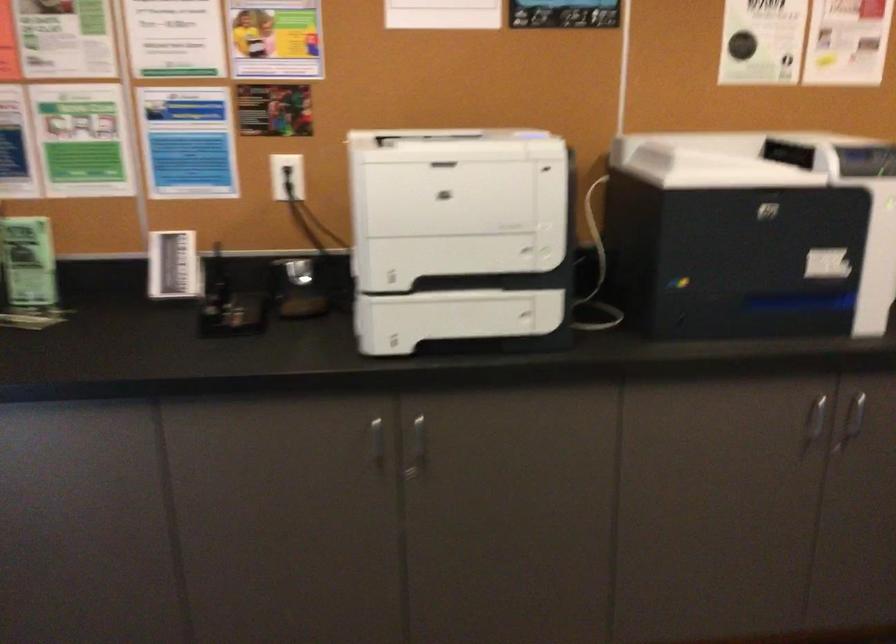
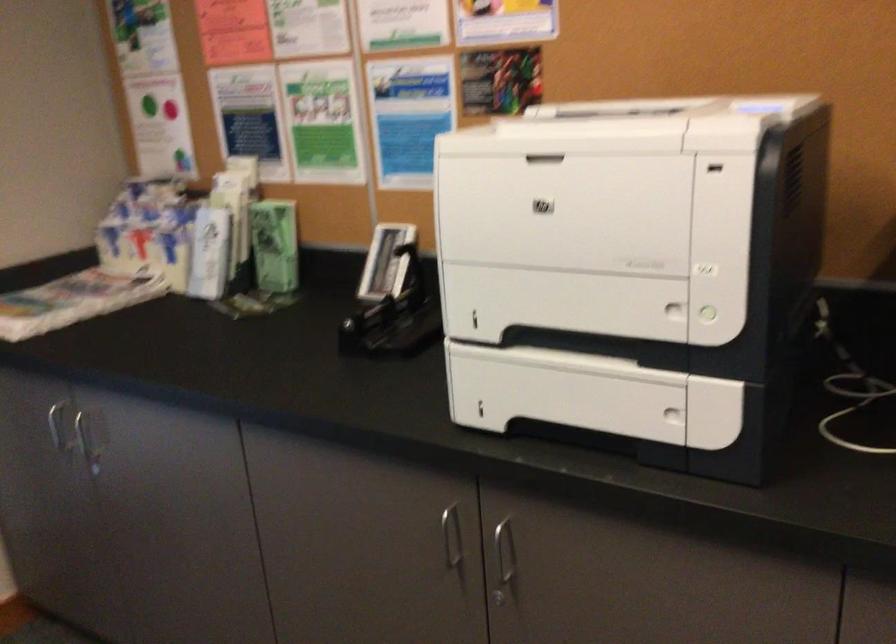
Question: The first image is from the beginning of the video and the second image is from the end. How did the camera likely rotate when shooting the video?

Choices:
 (A) Left
 (B) Right
 (C) Up
 (D) Down

Answer: (A)